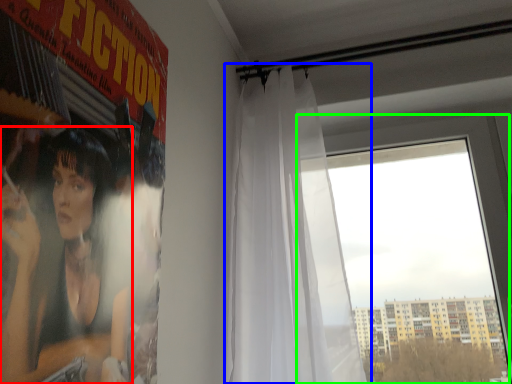
Question: Which object is positioned closest to person (highlighted by a red box)? Select from curtain (highlighted by a blue box) and window (highlighted by a green box).

Choices:
 (A) curtain
 (B) window

Answer: (A)